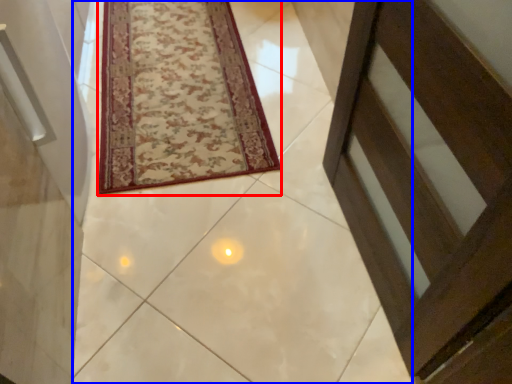
Question: Which object is further to the camera taking this photo, mat (highlighted by a red box) or path (highlighted by a blue box)?

Choices:
 (A) mat
 (B) path

Answer: (A)